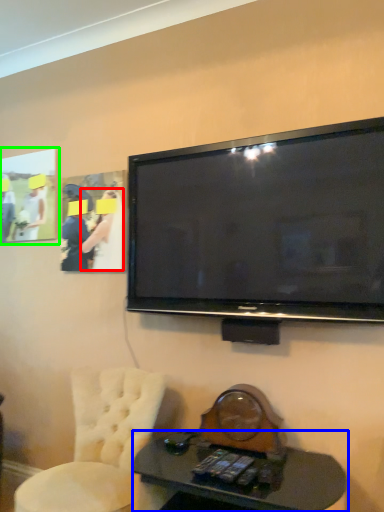
Question: Which is nearer to the person (highlighted by a red box)? desk (highlighted by a blue box) or picture frame (highlighted by a green box).

Choices:
 (A) desk
 (B) picture frame

Answer: (B)